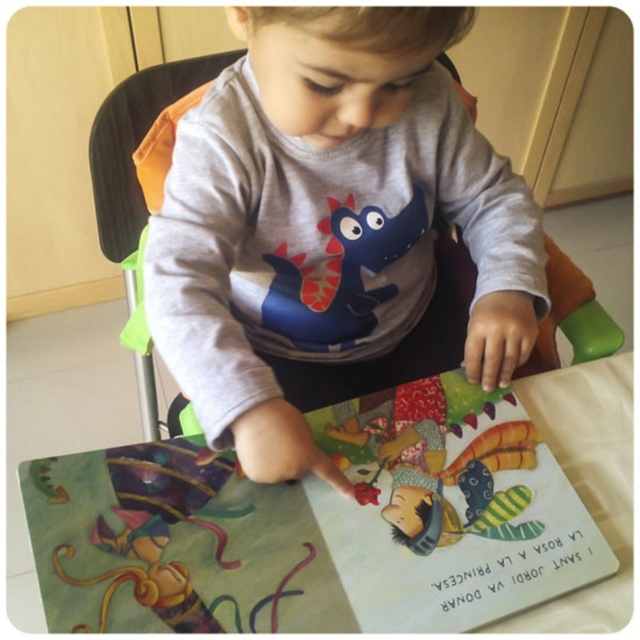
You are a parent trying to ensure your child can comfortably read their book while sitting in the high chair. The recommended distance for comfortable reading is between 15 to 25 centimeters. Can the child read the paper book at center comfortably while wearing the gray matte shirt at center?

The distance between the gray matte shirt at center and the paper book at center is 17.05 centimeters, which falls within the recommended 15 to 25 centimeter range. Therefore, the child can read the paper book at center comfortably while wearing the gray matte shirt at center.

You are a photographer taking a picture of the child and the book. You notice two points marked on the image at coordinates point (x=394, y=525) and point (x=445, y=518). Which point is closer to the camera?

Point (x=394, y=525) is closer to the camera than point (x=445, y=518).